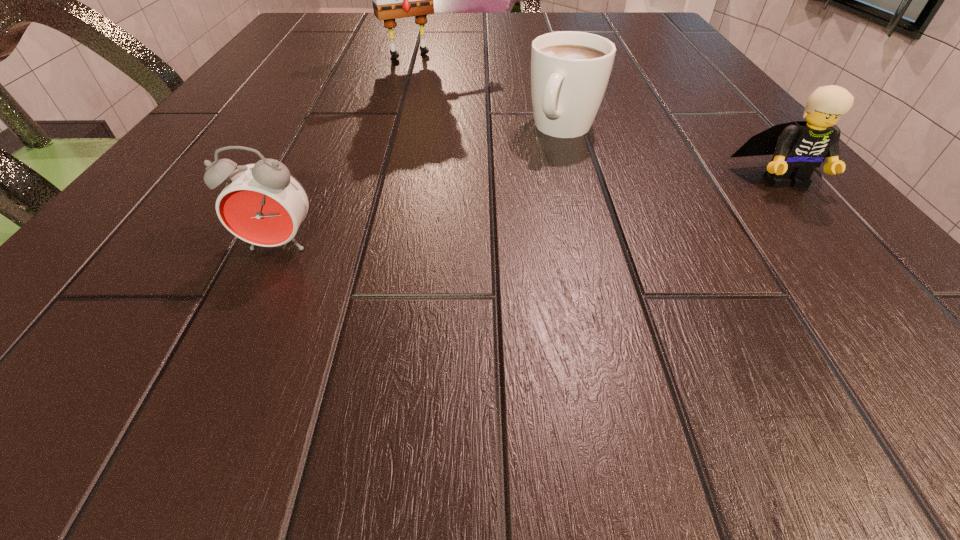
The height and width of the screenshot is (540, 960). I want to click on vacant area that lies between the alarm clock and the cappuccino, so click(421, 187).

Where is `empty space that is in between the third farthest object and the third object from left to right`? empty space that is in between the third farthest object and the third object from left to right is located at coordinates (673, 153).

Find the location of a particular element. The image size is (960, 540). free area in between the sponge and the rightmost object is located at coordinates tap(596, 117).

Identify the location of free space that is in between the third object from left to right and the alarm clock. This screenshot has width=960, height=540. (421, 187).

I want to click on free point between the tallest object and the Lego, so click(596, 117).

Find the location of a particular element. object that ranks as the third closest to the rightmost object is located at coordinates (262, 203).

Locate which object ranks second in proximity to the third farthest object. Please provide its 2D coordinates. Your answer should be formatted as a tuple, i.e. [(x, y)], where the tuple contains the x and y coordinates of a point satisfying the conditions above.

[(391, 0)]